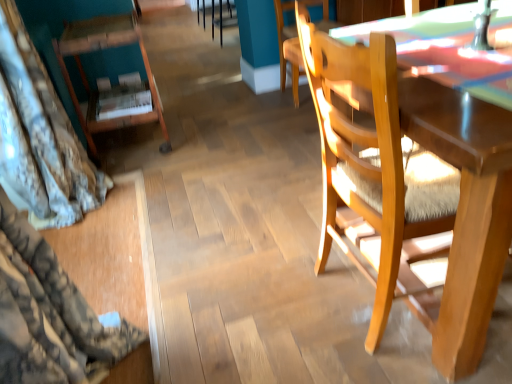
Where is `wooden bookshelf at left, placed as the 1th chair when sorted from left to right`? This screenshot has width=512, height=384. wooden bookshelf at left, placed as the 1th chair when sorted from left to right is located at coordinates coord(114,87).

Measure the distance between wooden chair at right, which appears as the 3th chair when viewed from the back, and camera.

The distance of wooden chair at right, which appears as the 3th chair when viewed from the back, from camera is 26.79 inches.

The image size is (512, 384). What are the coordinates of `wooden bookshelf at left, the 2th chair in the back-to-front sequence` in the screenshot? It's located at (114, 87).

From the image's perspective, is wooden bookshelf at left, which is counted as the 3th chair, starting from the right, on wooden chair at right, which appears as the 3th chair when viewed from the back?

Indeed, from the image's perspective, wooden bookshelf at left, which is counted as the 3th chair, starting from the right, is shown above wooden chair at right, which appears as the 3th chair when viewed from the back.

From a real-world perspective, is wooden bookshelf at left, placed as the 1th chair when sorted from left to right, positioned over wooden chair at right, arranged as the first chair when viewed from the front, based on gravity?

No, from a real-world perspective, wooden bookshelf at left, placed as the 1th chair when sorted from left to right, is not on top of wooden chair at right, arranged as the first chair when viewed from the front.

Locate an element on the screen. the 1st chair positioned below the wooden chair at right, the 1th chair in the right-to-left sequence (from a real-world perspective) is located at coordinates (114, 87).

Who is bigger, wooden bookshelf at left, placed as the 1th chair when sorted from left to right, or wooden chair at right, the 3th chair positioned from the left?

Bigger between the two is wooden chair at right, the 3th chair positioned from the left.

Is wooden chair at right, arranged as the first chair when viewed from the front, in front of or behind wooden chair at center, which is the 1th chair in back-to-front order, in the image?

In the image, wooden chair at right, arranged as the first chair when viewed from the front, appears in front of wooden chair at center, which is the 1th chair in back-to-front order.

In order to click on chair located on the right of wooden chair at center, which ranks as the 2th chair in right-to-left order in this screenshot , I will do `click(412, 187)`.

From the image's perspective, is wooden chair at right, the 1th chair in the right-to-left sequence, above or below wooden chair at center, the third chair from the front?

wooden chair at right, the 1th chair in the right-to-left sequence, is situated lower than wooden chair at center, the third chair from the front, in the image.

Which point is more forward, (435,190) or (276,6)?

The point (435,190) is closer to the camera.

From the image's perspective, is wooden bookshelf at left, arranged as the 2th chair when viewed from the front, below wooden chair at center, the third chair from the front?

Yes, from the image's perspective, wooden bookshelf at left, arranged as the 2th chair when viewed from the front, is below wooden chair at center, the third chair from the front.

Between wooden bookshelf at left, which is counted as the 3th chair, starting from the right, and wooden chair at center, the 2th chair positioned from the left, which one has larger size?

With larger size is wooden bookshelf at left, which is counted as the 3th chair, starting from the right.

Is wooden bookshelf at left, which is counted as the 3th chair, starting from the right, thinner than wooden chair at center, the third chair from the front?

Yes.

Is wooden bookshelf at left, placed as the 1th chair when sorted from left to right, inside or outside of wooden chair at center, which is the 1th chair in back-to-front order?

wooden bookshelf at left, placed as the 1th chair when sorted from left to right, cannot be found inside wooden chair at center, which is the 1th chair in back-to-front order.

Is wooden chair at right, the 1th chair in the right-to-left sequence, spatially inside wooden bookshelf at left, arranged as the 2th chair when viewed from the front, or outside of it?

wooden chair at right, the 1th chair in the right-to-left sequence, cannot be found inside wooden bookshelf at left, arranged as the 2th chair when viewed from the front.

From a real-world perspective, between wooden chair at right, the 1th chair in the right-to-left sequence, and wooden bookshelf at left, placed as the 1th chair when sorted from left to right, who is vertically lower?

wooden bookshelf at left, placed as the 1th chair when sorted from left to right, is physically lower.

Looking at this image, between wooden chair at right, the 3th chair positioned from the left, and wooden bookshelf at left, which is counted as the 3th chair, starting from the right, which one appears on the left side from the viewer's perspective?

wooden bookshelf at left, which is counted as the 3th chair, starting from the right, is more to the left.

In order to click on the 1st chair to the right of the wooden bookshelf at left, which is counted as the 3th chair, starting from the right, counting from the anchor's position in this screenshot , I will do click(288, 48).

Visually, is wooden chair at center, which is the 1th chair in back-to-front order, positioned to the left or to the right of wooden bookshelf at left, which is counted as the 3th chair, starting from the right?

Based on their positions, wooden chair at center, which is the 1th chair in back-to-front order, is located to the right of wooden bookshelf at left, which is counted as the 3th chair, starting from the right.

Does wooden chair at center, which ranks as the 2th chair in right-to-left order, have a greater width compared to wooden bookshelf at left, placed as the 1th chair when sorted from left to right?

Correct, the width of wooden chair at center, which ranks as the 2th chair in right-to-left order, exceeds that of wooden bookshelf at left, placed as the 1th chair when sorted from left to right.

Considering the positions of point (289, 54) and point (373, 320), is point (289, 54) closer or farther from the camera than point (373, 320)?

Point (289, 54) appears to be farther away from the viewer than point (373, 320).

Which is correct: wooden chair at center, the third chair from the front, is inside wooden chair at right, arranged as the first chair when viewed from the front, or outside of it?

wooden chair at center, the third chair from the front, exists outside the volume of wooden chair at right, arranged as the first chair when viewed from the front.

From a real-world perspective, who is located lower, wooden chair at center, which is the 1th chair in back-to-front order, or wooden chair at right, arranged as the first chair when viewed from the front?

In real-world perspective, wooden chair at center, which is the 1th chair in back-to-front order, is lower.

Can you tell me how much wooden chair at center, the 2th chair positioned from the left, and wooden chair at right, arranged as the first chair when viewed from the front, differ in facing direction?

The angular difference between wooden chair at center, the 2th chair positioned from the left, and wooden chair at right, arranged as the first chair when viewed from the front, is 4.11 degrees.

Find the location of a particular element. This screenshot has width=512, height=384. chair located in front of the wooden bookshelf at left, the 2th chair in the back-to-front sequence is located at coordinates (412, 187).

From the image's perspective, starting from the wooden chair at right, arranged as the first chair when viewed from the front, which chair is the 2nd one above? Please provide its 2D coordinates.

[(288, 48)]

From the image, which object appears to be nearer to wooden bookshelf at left, which is counted as the 3th chair, starting from the right, wooden chair at right, the 3th chair positioned from the left, or wooden chair at center, which is the 1th chair in back-to-front order?

Among the two, wooden chair at center, which is the 1th chair in back-to-front order, is located nearer to wooden bookshelf at left, which is counted as the 3th chair, starting from the right.

Based on their spatial positions, is wooden bookshelf at left, arranged as the 2th chair when viewed from the front, or wooden chair at right, arranged as the first chair when viewed from the front, further from wooden chair at center, which ranks as the 2th chair in right-to-left order?

Among the two, wooden chair at right, arranged as the first chair when viewed from the front, is located further to wooden chair at center, which ranks as the 2th chair in right-to-left order.

Based on their spatial positions, is wooden chair at right, the 1th chair in the right-to-left sequence, or wooden bookshelf at left, which is counted as the 3th chair, starting from the right, closer to wooden chair at center, which is the 1th chair in back-to-front order?

The object closer to wooden chair at center, which is the 1th chair in back-to-front order, is wooden bookshelf at left, which is counted as the 3th chair, starting from the right.

Based on their spatial positions, is wooden chair at center, the 2th chair positioned from the left, or wooden bookshelf at left, arranged as the 2th chair when viewed from the front, further from wooden chair at right, the 1th chair in the right-to-left sequence?

wooden chair at center, the 2th chair positioned from the left, lies further to wooden chair at right, the 1th chair in the right-to-left sequence, than the other object.

When comparing their distances from wooden chair at right, which appears as the 3th chair when viewed from the back, does wooden bookshelf at left, which is counted as the 3th chair, starting from the right, or wooden chair at center, the third chair from the front, seem further?

wooden chair at center, the third chair from the front, is positioned further to the anchor wooden chair at right, which appears as the 3th chair when viewed from the back.

Considering their positions, is wooden chair at center, which is the 1th chair in back-to-front order, positioned closer to wooden bookshelf at left, arranged as the 2th chair when viewed from the front, than wooden chair at right, the 3th chair positioned from the left?

Based on the image, wooden chair at center, which is the 1th chair in back-to-front order, appears to be nearer to wooden bookshelf at left, arranged as the 2th chair when viewed from the front.

Image resolution: width=512 pixels, height=384 pixels. What are the coordinates of `chair located between wooden chair at right, which appears as the 3th chair when viewed from the back, and wooden chair at center, the third chair from the front, in the depth direction` in the screenshot? It's located at (114, 87).